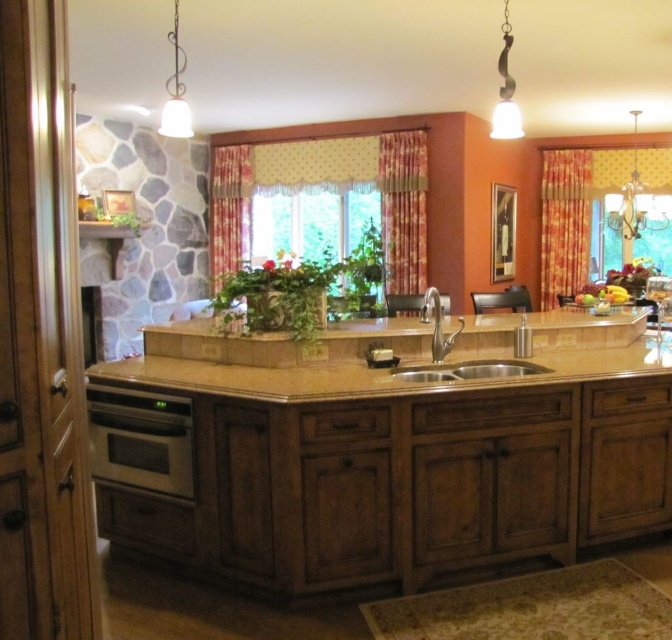
In the scene shown: Based on the coordinates provided, where is the brown polished wood counter top at center located in the image?

The brown polished wood counter top at center is located at the coordinates point (396, 452).